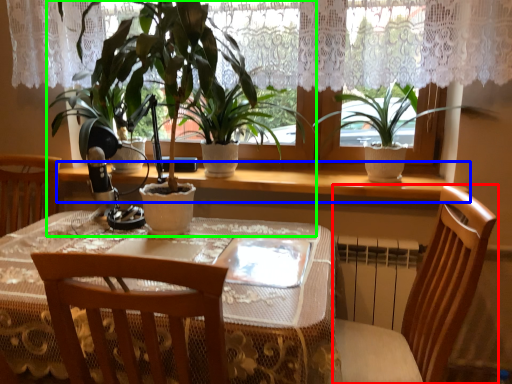
Question: Based on their relative distances, which object is nearer to chair (highlighted by a red box)? Choose from window sill (highlighted by a blue box) and houseplant (highlighted by a green box).

Choices:
 (A) window sill
 (B) houseplant

Answer: (A)